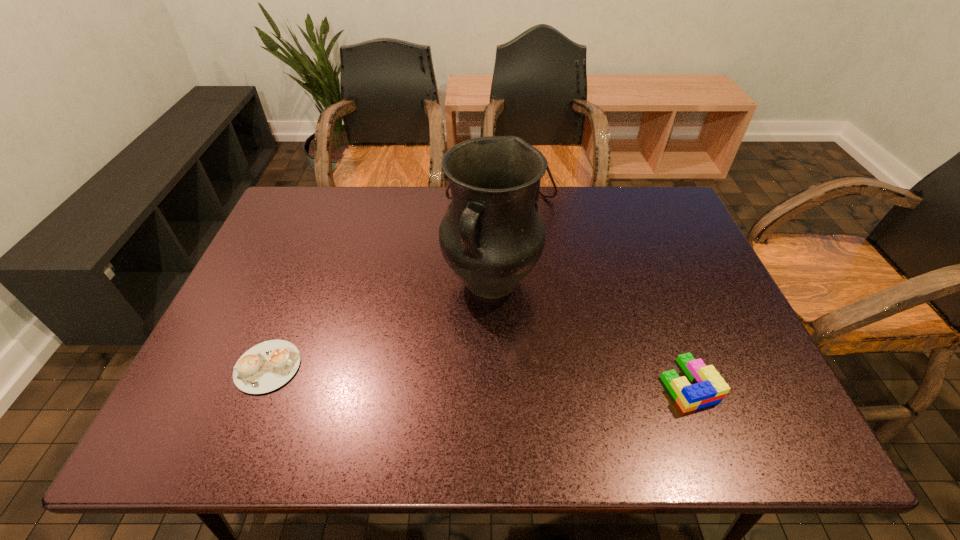
Where is `the shortest object`? The height and width of the screenshot is (540, 960). the shortest object is located at coordinates coord(266,366).

This screenshot has height=540, width=960. Identify the location of the leftmost object. (266, 366).

Locate an element on the screen. the third tallest object is located at coordinates (708, 388).

This screenshot has width=960, height=540. In order to click on the rightmost object in this screenshot , I will do `click(708, 388)`.

Image resolution: width=960 pixels, height=540 pixels. Find the location of `shoulder bag`. shoulder bag is located at coordinates (539, 191).

What are the coordinates of `the farthest object` in the screenshot? It's located at (539, 191).

This screenshot has height=540, width=960. Identify the location of the tallest object. (492, 237).

Locate an element on the screen. pitcher is located at coordinates (492, 237).

Locate an element on the screen. vacant area situated 0.140m on the back of the shortest object is located at coordinates (296, 296).

This screenshot has width=960, height=540. What are the coordinates of `free space located 0.120m on the right of the Lego` in the screenshot? It's located at (769, 383).